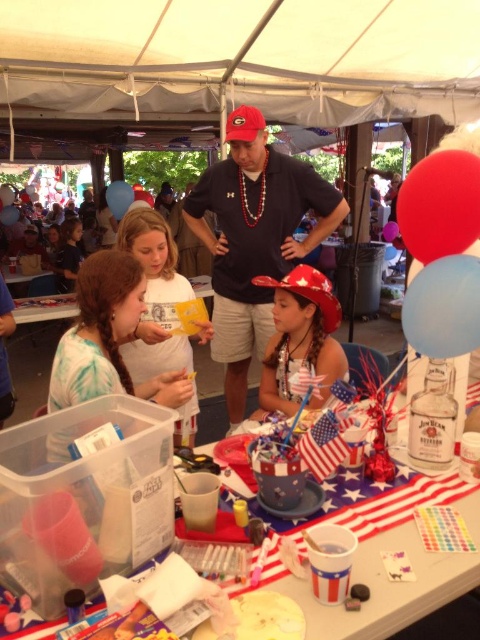
You are organizing a patriotic event and need to choose a balloon for a child to hold. Which balloon would be safer for a child to hold, the blue latex balloon at center or the blue glossy balloon at upper left?

The blue latex balloon at center has a smaller size compared to blue glossy balloon at upper left, so the blue latex balloon at center would be safer for a child to hold due to its smaller size.